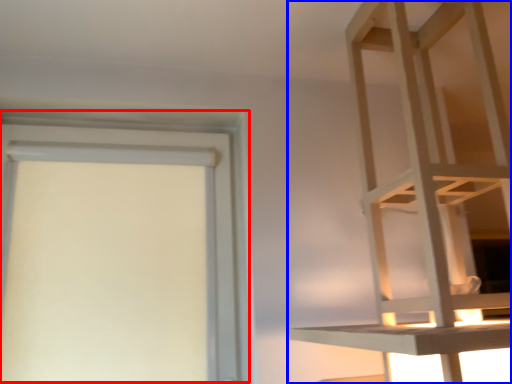
Question: Which object is closer to the camera taking this photo, bay window (highlighted by a red box) or furniture (highlighted by a blue box)?

Choices:
 (A) bay window
 (B) furniture

Answer: (B)